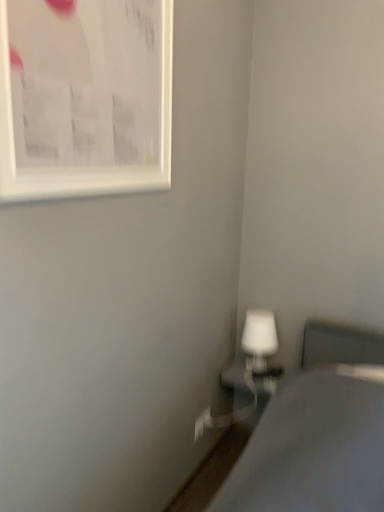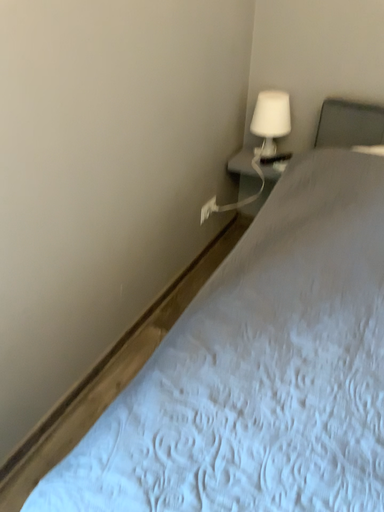
Question: How did the camera likely rotate when shooting the video?

Choices:
 (A) rotated upward
 (B) rotated downward

Answer: (B)